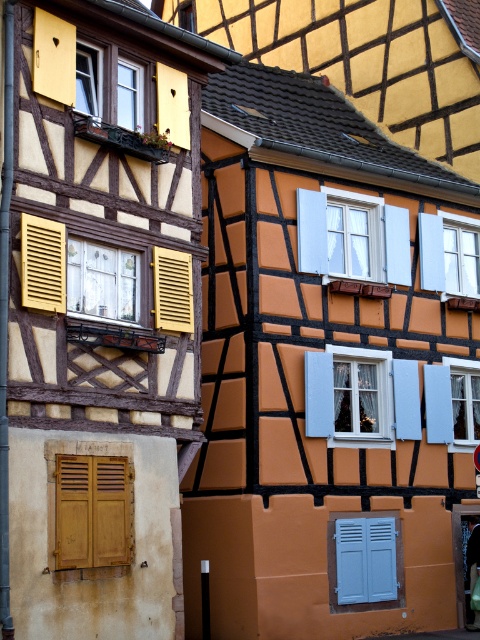
What is the exact location of the wooden slats at lower left in the image?

The wooden slats at lower left are located at point (93,512).

You are an architect designing a new building inspired by this half timbered style. You need to ensure that the shutters on the lower center of the building will be visible from the ground floor windows. Given that the ground floor windows are at eye level, will the blue matte shutter at lower center and the matte wood shutter at left be visible? Explain using their heights.

The blue matte shutter at lower center has a greater height compared to the matte wood shutter at left. Since the ground floor windows are at eye level, the taller blue matte shutter at lower center would likely be more visible from the ground floor windows compared to the shorter matte wood shutter at left.